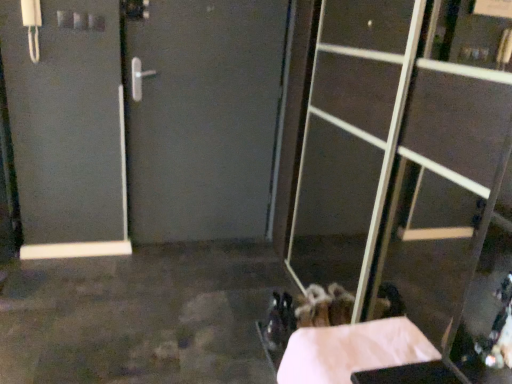
What do you see at coordinates (413, 142) in the screenshot? I see `transparent glass door at right` at bounding box center [413, 142].

You are a GUI agent. You are given a task and a screenshot of the screen. Output one action in this format:
    pyautogui.click(x=<x>, y=<y>)
    Task: Click on the transparent glass door at right
    
    Given the screenshot: What is the action you would take?
    pyautogui.click(x=413, y=142)

What is the approximate height of white paper at lower right?

white paper at lower right is 9.27 inches in height.

Describe the element at coordinates (352, 351) in the screenshot. I see `white paper at lower right` at that location.

Where is `white paper at lower right`? The image size is (512, 384). white paper at lower right is located at coordinates (352, 351).

In order to click on transparent glass door at right in this screenshot , I will do `click(413, 142)`.

Is transparent glass door at right to the right of white paper at lower right from the viewer's perspective?

Yes.

Does transparent glass door at right come in front of white paper at lower right?

Yes, it is.

Is point (391, 20) closer to viewer compared to point (388, 337)?

That is False.

From the image's perspective, is transparent glass door at right below white paper at lower right?

No, from the image's perspective, transparent glass door at right is not beneath white paper at lower right.

Based on the photo, from a real-world perspective, is transparent glass door at right physically above white paper at lower right?

Yes.

Can you confirm if transparent glass door at right is thinner than white paper at lower right?

Yes, transparent glass door at right is thinner than white paper at lower right.

From their relative heights in the image, would you say transparent glass door at right is taller or shorter than white paper at lower right?

In the image, transparent glass door at right appears to be taller than white paper at lower right.

Who is bigger, transparent glass door at right or white paper at lower right?

Bigger between the two is transparent glass door at right.

Choose the correct answer: Is transparent glass door at right inside white paper at lower right or outside it?

The correct answer is: outside.

Is transparent glass door at right next to white paper at lower right?

transparent glass door at right and white paper at lower right are clearly separated.

Is white paper at lower right at the back of transparent glass door at right?

No, transparent glass door at right is not facing away from white paper at lower right.

Can you tell me how much transparent glass door at right and white paper at lower right differ in facing direction?

0.748 degrees separate the facing orientations of transparent glass door at right and white paper at lower right.

Find the location of a particular element. glass door located above the white paper at lower right (from the image's perspective) is located at coordinates (413, 142).

Is white paper at lower right at the left side of transparent glass door at right?

Correct, you'll find white paper at lower right to the left of transparent glass door at right.

Between white paper at lower right and transparent glass door at right, which one is positioned behind?

white paper at lower right is more distant.

Is point (371, 329) behind point (325, 272)?

No, it is not.

From the image's perspective, which one is positioned higher, white paper at lower right or transparent glass door at right?

From the image's view, transparent glass door at right is above.

From a real-world perspective, who is located higher, white paper at lower right or transparent glass door at right?

In real-world perspective, transparent glass door at right is above.

Looking at their sizes, would you say white paper at lower right is wider or thinner than transparent glass door at right?

white paper at lower right is wider than transparent glass door at right.

Does white paper at lower right have a greater height compared to transparent glass door at right?

In fact, white paper at lower right may be shorter than transparent glass door at right.

Based on the photo, can you confirm if white paper at lower right is smaller than transparent glass door at right?

Indeed, white paper at lower right has a smaller size compared to transparent glass door at right.

Is transparent glass door at right a part of white paper at lower right?

No, transparent glass door at right is located outside of white paper at lower right.

Is there a large distance between white paper at lower right and transparent glass door at right?

Yes.

Looking at this image, is white paper at lower right turned away from transparent glass door at right?

Yes.

In the scene shown: Can you tell me how much white paper at lower right and transparent glass door at right differ in facing direction?

The angular difference between white paper at lower right and transparent glass door at right is 0.748 degrees.

Measure the distance from white paper at lower right to transparent glass door at right.

white paper at lower right is 1.30 meters from transparent glass door at right.

Find the location of `concrete that appears behind the transparent glass door at right`. concrete that appears behind the transparent glass door at right is located at coordinates (352, 351).

In the image, there is a transparent glass door at right. Identify the location of concrete below it (from the image's perspective). The height and width of the screenshot is (384, 512). (352, 351).

This screenshot has width=512, height=384. Identify the location of concrete beneath the transparent glass door at right (from a real-world perspective). (352, 351).